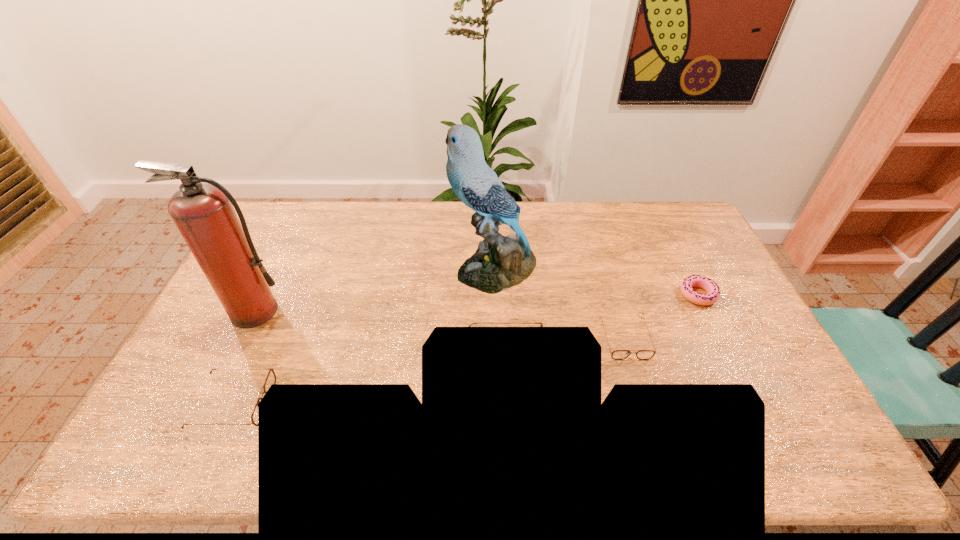
Where is `vacant point located between the fifth object from left to right and the rightmost object`? This screenshot has height=540, width=960. vacant point located between the fifth object from left to right and the rightmost object is located at coordinates (661, 317).

You are a GUI agent. You are given a task and a screenshot of the screen. Output one action in this format:
    pyautogui.click(x=<x>, y=<y>)
    Task: Click on the vacant area that lies between the fire extinguisher and the second shortest sunglasses
    
    Given the screenshot: What is the action you would take?
    (245, 357)

The height and width of the screenshot is (540, 960). I want to click on free point between the fire extinguisher and the parakeet, so click(375, 290).

The image size is (960, 540). I want to click on free point between the second object from right to left and the fire extinguisher, so click(440, 326).

The height and width of the screenshot is (540, 960). I want to click on unoccupied position between the third tallest object and the parakeet, so click(x=500, y=314).

At what (x,y) coordinates should I click in order to perform the action: click on free spot between the tallest sunglasses and the parakeet. Please return your answer as a coordinate pair (x, y). Looking at the image, I should click on (500, 314).

Where is `the third closest object to the third shortest object`? The width and height of the screenshot is (960, 540). the third closest object to the third shortest object is located at coordinates (500, 262).

Identify the location of object that ranks as the closest to the parakeet. (541, 324).

Identify which sunglasses is the second closest to the shortest sunglasses. Please provide its 2D coordinates. Your answer should be formatted as a tuple, i.e. [(x, y)], where the tuple contains the x and y coordinates of a point satisfying the conditions above.

[(271, 377)]

This screenshot has height=540, width=960. What are the coordinates of `sunglasses that is the second closest to the second tallest sunglasses` in the screenshot? It's located at (617, 354).